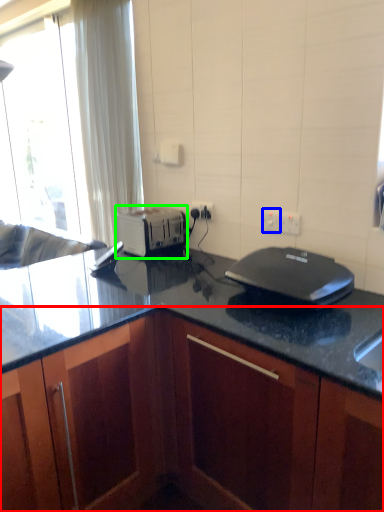
Question: Which is farther away from cabinetry (highlighted by a red box)? electric outlet (highlighted by a blue box) or toaster (highlighted by a green box)?

Choices:
 (A) electric outlet
 (B) toaster

Answer: (A)